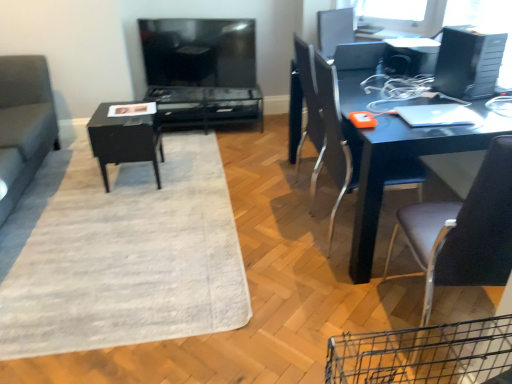
Question: Does leather-like brown chair at right, which appears as the 1th chair when viewed from the front, appear on the left side of suede gray couch at left?

Choices:
 (A) yes
 (B) no

Answer: (B)

Question: Does leather-like brown chair at right, which is counted as the 2th chair, starting from the back, have a lesser height compared to suede gray couch at left?

Choices:
 (A) yes
 (B) no

Answer: (B)

Question: From a real-world perspective, is leather-like brown chair at right, which appears as the 1th chair when viewed from the front, beneath suede gray couch at left?

Choices:
 (A) no
 (B) yes

Answer: (A)

Question: Is leather-like brown chair at right, which is counted as the 2th chair, starting from the back, thinner than suede gray couch at left?

Choices:
 (A) yes
 (B) no

Answer: (A)

Question: Considering the relative positions of leather-like brown chair at right, which appears as the 1th chair when viewed from the front, and suede gray couch at left in the image provided, is leather-like brown chair at right, which appears as the 1th chair when viewed from the front, to the right of suede gray couch at left from the viewer's perspective?

Choices:
 (A) yes
 (B) no

Answer: (A)

Question: From a real-world perspective, is leather-like brown chair at right, which appears as the 1th chair when viewed from the front, on suede gray couch at left?

Choices:
 (A) yes
 (B) no

Answer: (A)

Question: Is matte black chair at right, the 1th chair when ordered from back to front, smaller than black glossy table at center, which appears as the 2th table when viewed from the back?

Choices:
 (A) no
 (B) yes

Answer: (A)

Question: From a real-world perspective, is matte black chair at right, the 1th chair when ordered from back to front, physically below black glossy table at center, which appears as the 2th table when viewed from the back?

Choices:
 (A) yes
 (B) no

Answer: (B)

Question: Can you confirm if matte black chair at right, the 1th chair when ordered from back to front, is thinner than black glossy table at center, which is the first table in front-to-back order?

Choices:
 (A) no
 (B) yes

Answer: (A)

Question: Is matte black chair at right, which is counted as the 2th chair, starting from the front, wider than black glossy table at center, which is the first table in front-to-back order?

Choices:
 (A) no
 (B) yes

Answer: (B)

Question: Is matte black chair at right, the 1th chair when ordered from back to front, not near black glossy table at center, which is the first table in front-to-back order?

Choices:
 (A) yes
 (B) no

Answer: (A)

Question: Is matte black chair at right, which is counted as the 2th chair, starting from the front, next to black glossy table at center, which is the first table in front-to-back order?

Choices:
 (A) yes
 (B) no

Answer: (B)

Question: Is matte black tv at upper center aimed at black glossy table at center, which is the first table in front-to-back order?

Choices:
 (A) yes
 (B) no

Answer: (A)